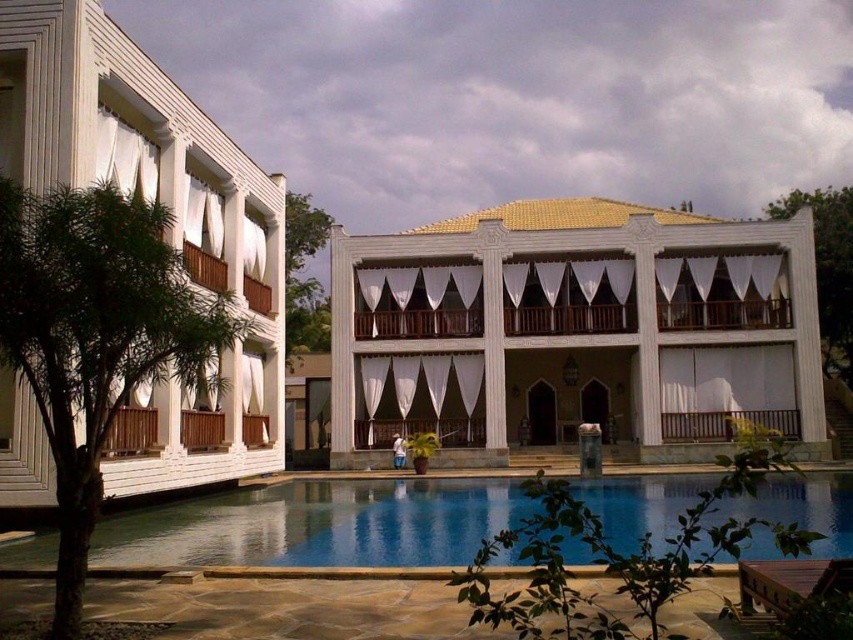
You are standing at the main entrance of the building and want to go to the blue glassy swimming pool at center. Which direction should you head towards?

The blue glassy swimming pool at center is located at point (x=317, y=524) in the scene, so you should head towards the center area in front of the building to reach it.

You are planning to install a new bench in the garden area between the green leafy tree at upper right and the green leafy tree at center. To ensure there is enough space for people to walk around both trees, which tree requires a larger clearance area due to its width?

The green leafy tree at upper right might require a larger clearance area because it is wider than the green leafy tree at center according to the description.

You are planning to host a pool party and need to place a large inflatable slide in the blue glassy swimming pool at center. Considering the presence of the green leafy tree at center, will the slide fit entirely within the pool without overlapping the tree?

The blue glassy swimming pool at center is wider than the green leafy tree at center, so the slide can fit entirely within the pool without overlapping the tree.